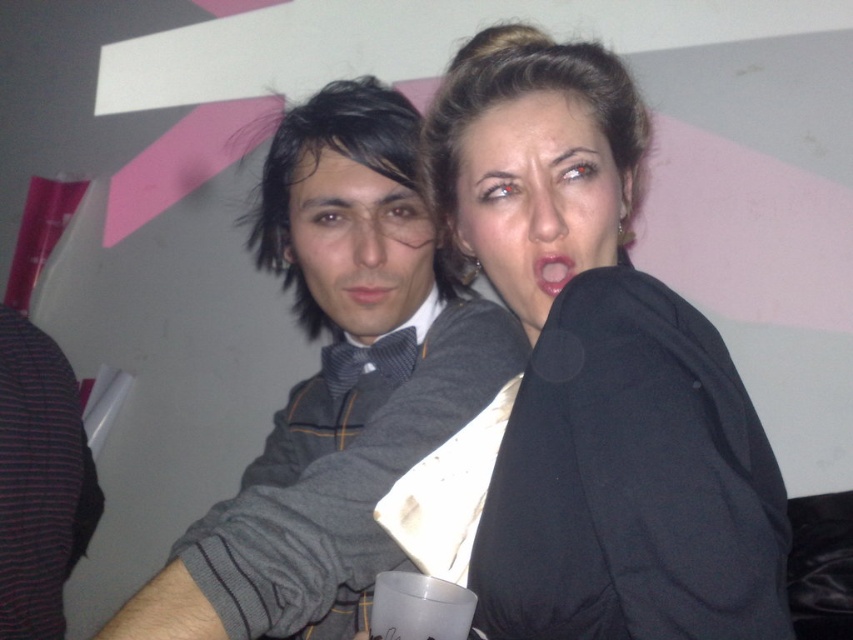
Is point (527, 227) closer to camera compared to point (560, 259)?

Yes.

Which is more to the left, matte black hair at center or pink matte lips at center?

Positioned to the left is pink matte lips at center.

Between point (567, 230) and point (561, 278), which one is positioned behind?

Positioned behind is point (561, 278).

Locate an element on the screen. matte black hair at center is located at coordinates (537, 196).

Between point (520, 212) and point (340, 220), which one is positioned in front?

Point (520, 212)

Does matte black hair at center have a lesser height compared to matte black bow tie at center?

Correct, matte black hair at center is not as tall as matte black bow tie at center.

Is point (532, 280) more distant than point (427, 236)?

That is False.

Find the location of a particular element. This screenshot has width=853, height=640. matte black hair at center is located at coordinates (537, 196).

Does point (380, 420) come in front of point (363, 326)?

Yes, point (380, 420) is in front of point (363, 326).

Locate an element on the screen. This screenshot has height=640, width=853. gray striped sweater at center is located at coordinates (334, 387).